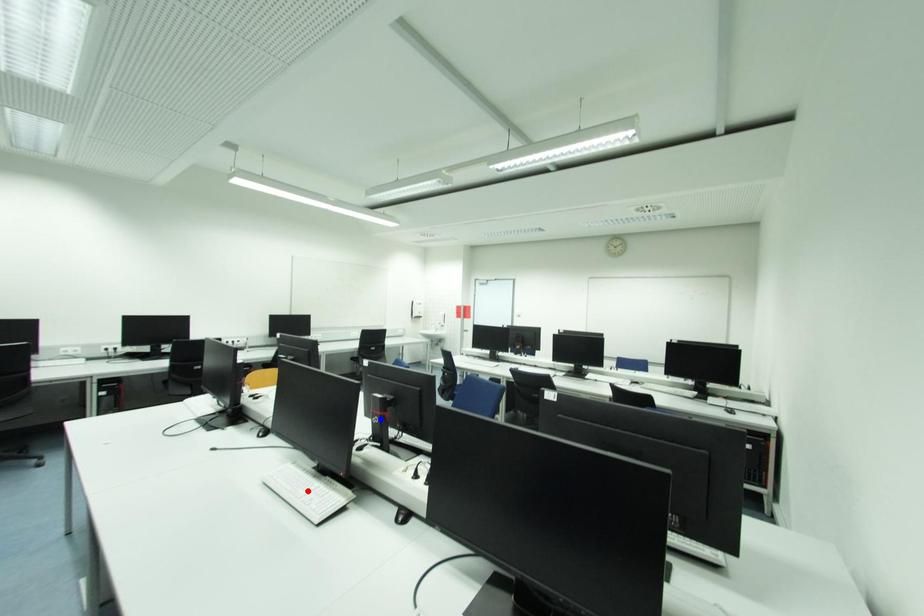
Question: Two points are marked on the image. Which point is closer to the camera?

Choices:
 (A) Blue point is closer.
 (B) Red point is closer.

Answer: (B)